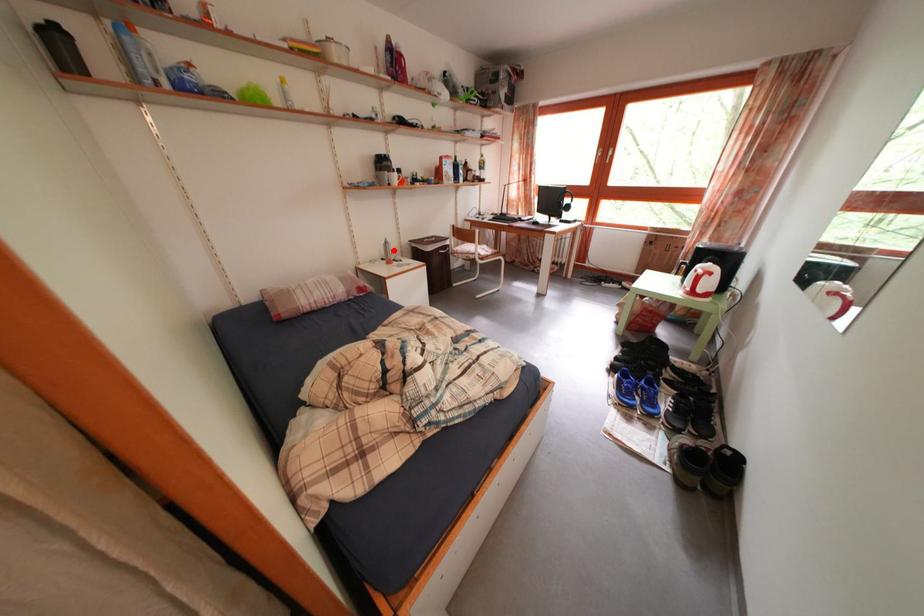
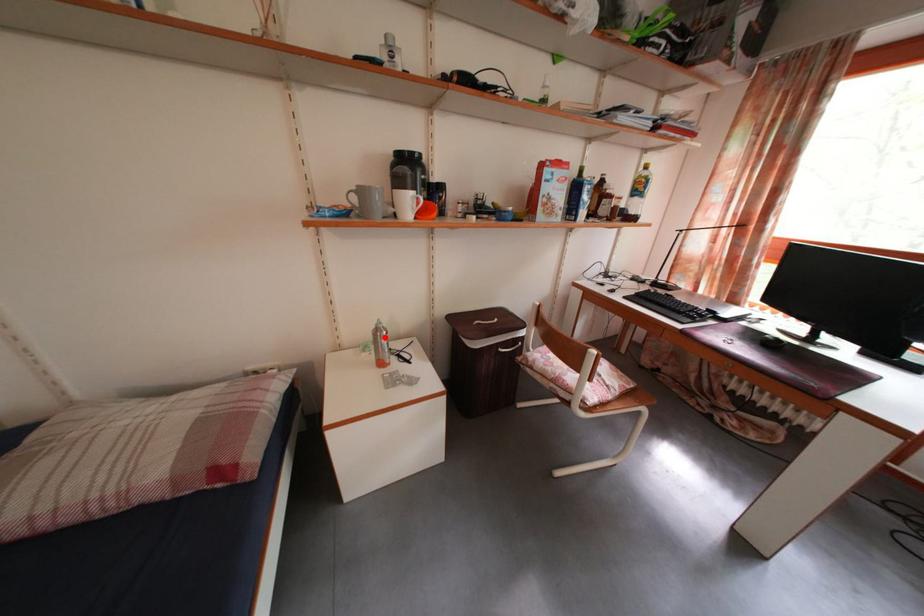
I am providing you with two images of the same scene from different viewpoints. A red point is marked on the first image and another point is marked on the second image. Do the highlighted points in image1 and image2 indicate the same real-world spot?

Yes